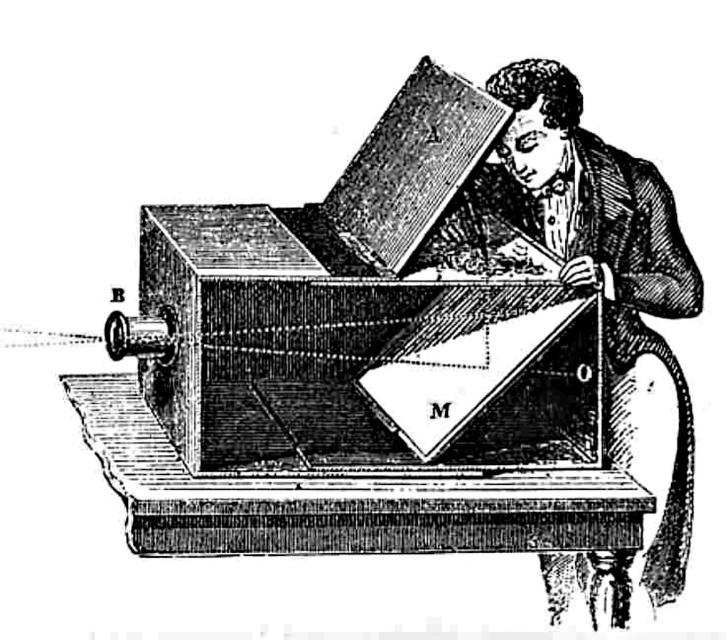
Question: Which point is closer to the camera taking this photo?

Choices:
 (A) (395, 184)
 (B) (622, 305)

Answer: (A)

Question: Which object appears farthest from the camera in this image?

Choices:
 (A) wooden piano at center
 (B) wooden coat at upper right

Answer: (B)

Question: Does wooden piano at center appear on the right side of wooden coat at upper right?

Choices:
 (A) no
 (B) yes

Answer: (A)

Question: Can you confirm if wooden piano at center is smaller than wooden coat at upper right?

Choices:
 (A) no
 (B) yes

Answer: (A)

Question: Which point is farther to the camera?

Choices:
 (A) (447, 250)
 (B) (142, 467)

Answer: (A)

Question: Is wooden piano at center thinner than wooden coat at upper right?

Choices:
 (A) yes
 (B) no

Answer: (B)